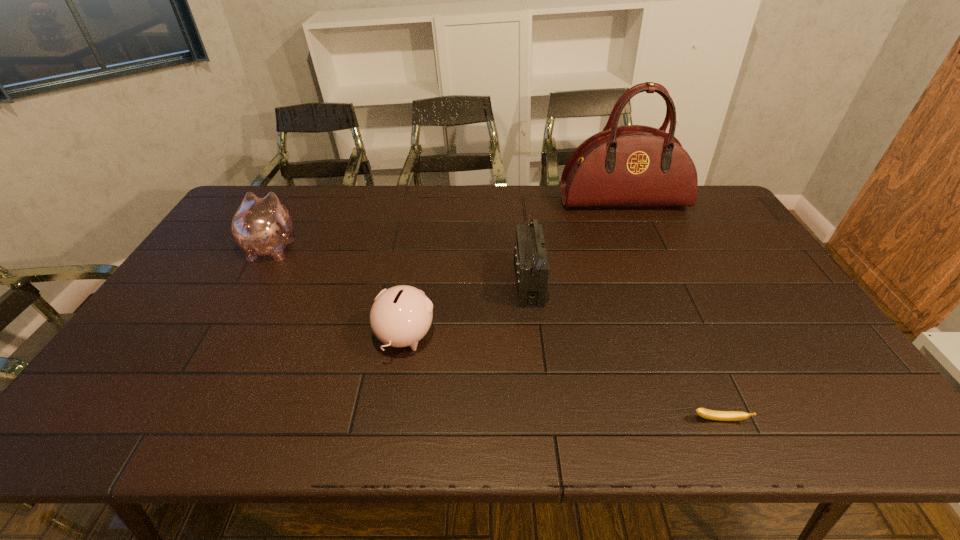
I want to click on the tallest object, so (634, 165).

The height and width of the screenshot is (540, 960). In order to click on handbag in this screenshot , I will do `click(634, 165)`.

You are a GUI agent. You are given a task and a screenshot of the screen. Output one action in this format:
    pyautogui.click(x=<x>, y=<y>)
    Task: Click on the fourth shortest object
    The height and width of the screenshot is (540, 960).
    Given the screenshot: What is the action you would take?
    pyautogui.click(x=531, y=266)

At what (x,y) coordinates should I click in order to perform the action: click on the third object from left to right. Please return your answer as a coordinate pair (x, y). Looking at the image, I should click on (531, 266).

Locate an element on the screen. The image size is (960, 540). the leftmost object is located at coordinates (261, 226).

You are a GUI agent. You are given a task and a screenshot of the screen. Output one action in this format:
    pyautogui.click(x=<x>, y=<y>)
    Task: Click on the taller piggy bank
    
    Given the screenshot: What is the action you would take?
    pyautogui.click(x=261, y=226)

What are the coordinates of `the second nearest object` in the screenshot? It's located at (400, 316).

The image size is (960, 540). In order to click on the shorter piggy bank in this screenshot , I will do (400, 316).

I want to click on the nearest object, so click(x=702, y=412).

Find the location of a particular element. This screenshot has height=540, width=960. the shortest object is located at coordinates (702, 412).